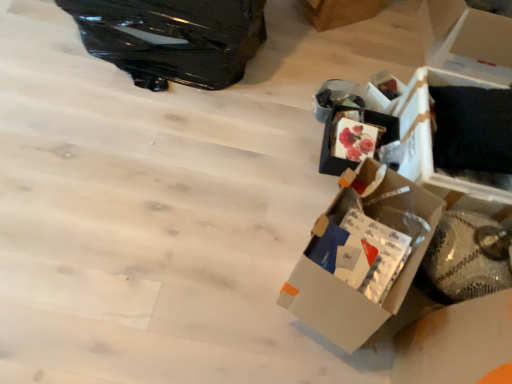
I want to click on vacant space that's between glossy black suitcase at upper left and white cardboard box at center-right, so click(x=234, y=151).